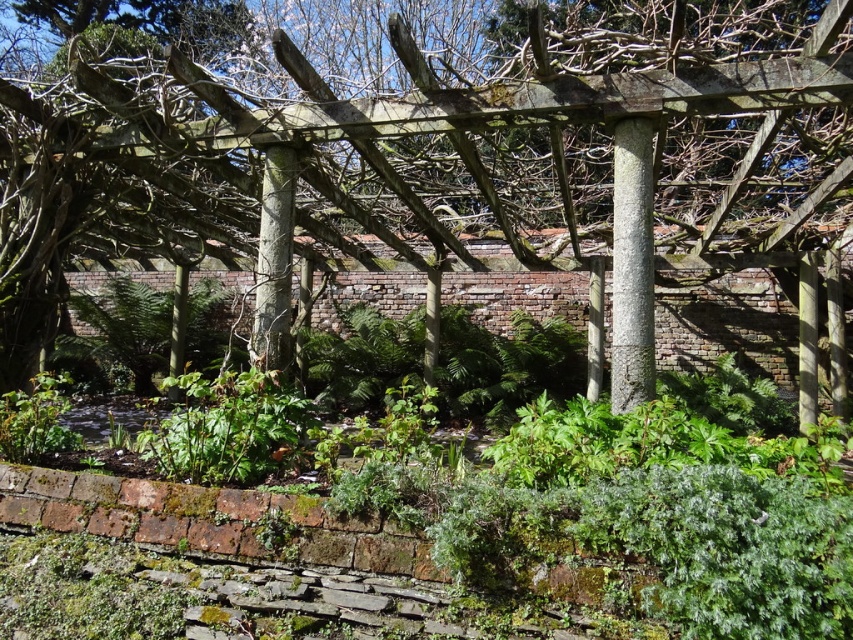
You are standing at the entrance of the garden and want to find the smooth bark tree at center. According to the coordinates provided, in which direction should you look to locate it?

The smooth bark tree at center is located at coordinates point (408, 160), which means it is positioned to the left of the center point in the garden. You should look towards the left side of the garden to find it.

You are designing a pathway that needs to be 3 feet wide between the smooth bark tree at center and the gray rough stone column at center. Is the current distance sufficient for this pathway?

The smooth bark tree at center is 32.92 inches from the gray rough stone column at center. Since 32.92 inches is approximately 2.74 feet, which is less than the required 3 feet, the current distance is insufficient for the pathway.